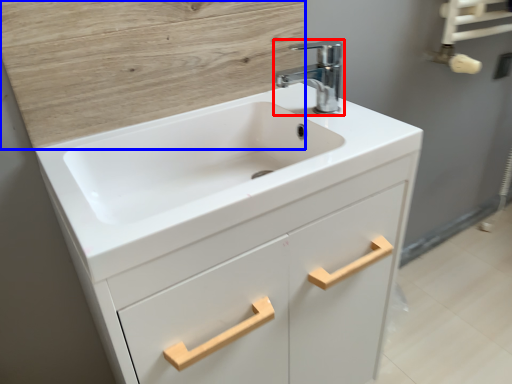
Question: Among these objects, which one is farthest to the camera, tap (highlighted by a red box) or plywood (highlighted by a blue box)?

Choices:
 (A) tap
 (B) plywood

Answer: (A)